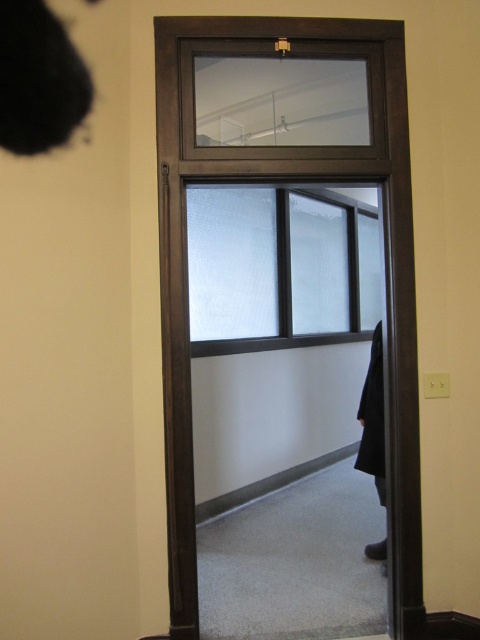
You are standing in the hallway and want to enter the room through the matte dark brown glass door at center. What are the coordinates of the door to locate it?

The coordinates of the matte dark brown glass door at center are at point (292, 180).

You are moving a large painting that is 1.5 meters wide. You want to hang it on the wall near the matte dark brown glass door at center and the frosted glass window at center. Which object should you place it closer to if you want the painting to fit better?

The matte dark brown glass door at center is smaller than the frosted glass window at center. Therefore, placing the large painting closer to the frosted glass window at center would provide more space for the 1.5 meters wide painting to fit better.